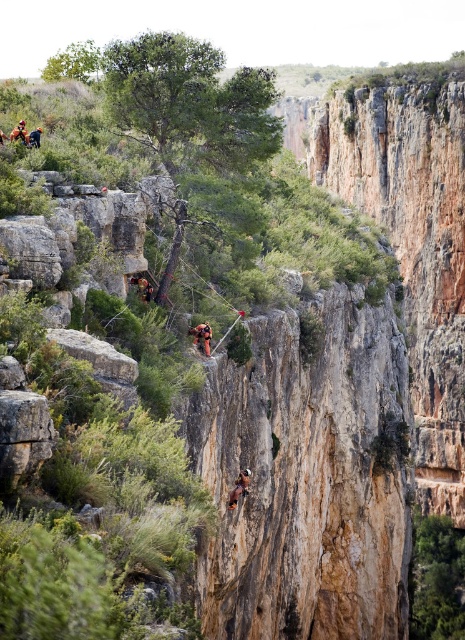
Question: Considering the real-world distances, which object is closest to the orange fabric harness at upper left?

Choices:
 (A) camouflage fabric harness at center
 (B) camouflage fabric person at center

Answer: (A)

Question: Among these objects, which one is nearest to the camera?

Choices:
 (A) camouflage fabric harness at center
 (B) orange fabric harness at upper left

Answer: (A)

Question: Which point is closer to the camera?

Choices:
 (A) (241, 474)
 (B) (31, 141)
 (C) (200, 332)

Answer: (C)

Question: Does camouflage fabric person at center come behind orange fabric harness at upper left?

Choices:
 (A) yes
 (B) no

Answer: (B)

Question: Does camouflage fabric person at center appear over orange fabric harness at upper left?

Choices:
 (A) yes
 (B) no

Answer: (B)

Question: Is camouflage fabric harness at center to the left of orange fabric harness at upper left from the viewer's perspective?

Choices:
 (A) yes
 (B) no

Answer: (B)